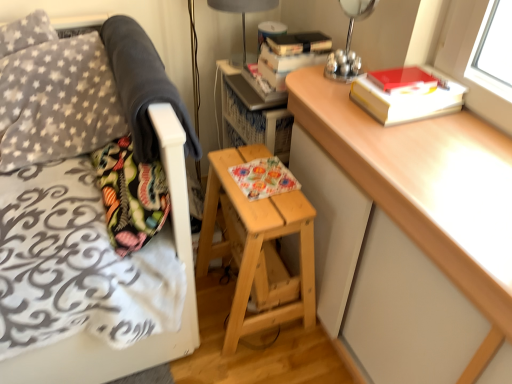
Question: Is dark gray fleece blanket at upper left positioned far away from metallic silver lamp at upper right, the 2th bedside lamp positioned from the left?

Choices:
 (A) no
 (B) yes

Answer: (A)

Question: Can you confirm if dark gray fleece blanket at upper left is taller than metallic silver lamp at upper right, the 2th bedside lamp positioned from the left?

Choices:
 (A) yes
 (B) no

Answer: (B)

Question: Considering the relative sizes of dark gray fleece blanket at upper left and metallic silver lamp at upper right, the 2th bedside lamp positioned from the left, in the image provided, is dark gray fleece blanket at upper left bigger than metallic silver lamp at upper right, the 2th bedside lamp positioned from the left,?

Choices:
 (A) no
 (B) yes

Answer: (B)

Question: From a real-world perspective, is dark gray fleece blanket at upper left under metallic silver lamp at upper right, which is counted as the 1th bedside lamp, starting from the right?

Choices:
 (A) no
 (B) yes

Answer: (B)

Question: Is dark gray fleece blanket at upper left shorter than metallic silver lamp at upper right, the first bedside lamp when ordered from front to back?

Choices:
 (A) no
 (B) yes

Answer: (B)

Question: Considering the relative positions of dark gray fleece blanket at upper left and metallic silver lamp at upper right, the first bedside lamp when ordered from front to back, in the image provided, is dark gray fleece blanket at upper left to the right of metallic silver lamp at upper right, the first bedside lamp when ordered from front to back, from the viewer's perspective?

Choices:
 (A) yes
 (B) no

Answer: (B)

Question: Does matte gray lampshade at upper center, the 2th bedside lamp in the right-to-left sequence, have a lesser height compared to hardcover book at upper right, the second paperback book when ordered from top to bottom?

Choices:
 (A) no
 (B) yes

Answer: (A)

Question: Is matte gray lampshade at upper center, the 2th bedside lamp in the right-to-left sequence, positioned far away from hardcover book at upper right, the 1th paperback book positioned from the bottom?

Choices:
 (A) yes
 (B) no

Answer: (B)

Question: Is matte gray lampshade at upper center, the 2th bedside lamp in the right-to-left sequence, oriented towards hardcover book at upper right, the 1th paperback book positioned from the bottom?

Choices:
 (A) yes
 (B) no

Answer: (B)

Question: Is matte gray lampshade at upper center, the 2th bedside lamp in the right-to-left sequence, positioned before hardcover book at upper right, the second paperback book when ordered from top to bottom?

Choices:
 (A) no
 (B) yes

Answer: (A)

Question: Are matte gray lampshade at upper center, which appears as the second bedside lamp when viewed from the front, and hardcover book at upper right, the 1th paperback book positioned from the bottom, beside each other?

Choices:
 (A) no
 (B) yes

Answer: (A)

Question: Does matte gray lampshade at upper center, placed as the 1th bedside lamp when sorted from left to right, appear on the left side of hardcover book at upper right, the second paperback book when ordered from top to bottom?

Choices:
 (A) yes
 (B) no

Answer: (A)

Question: Is fluffy fabric pillow at left smaller than light brown wooden stool at center?

Choices:
 (A) no
 (B) yes

Answer: (B)